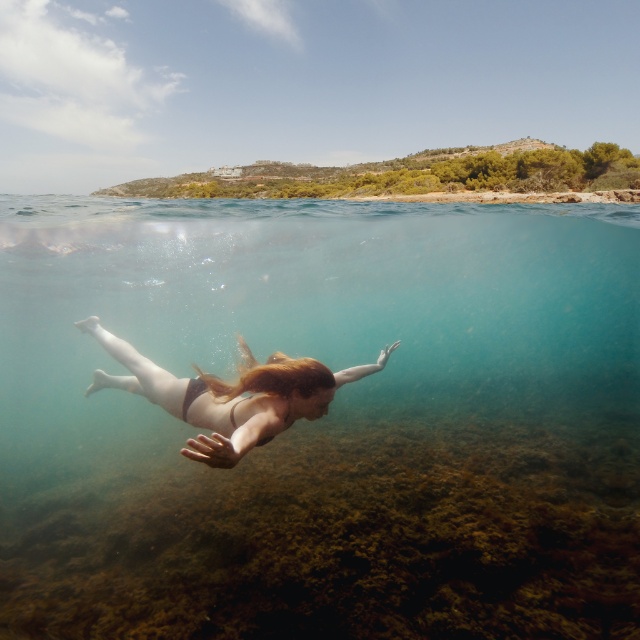
You are a photographer aiming to capture the swimmer in the image. You want to ensure the clear blue water at center and the blonde silky hair at center are both in focus. Which object should you adjust your camera focus to prioritize to ensure both are sharp?

The clear blue water at center is wider than the blonde silky hair at center, so you should focus on the wider area of the clear blue water at center to ensure both objects are in focus.

You are a photographer trying to capture the swimmer in the image. You notice the smooth skin girl at center and the blonde silky hair at center. Which object should you focus on if you want to ensure the larger subject is in sharp focus?

The smooth skin girl at center is bigger than the blonde silky hair at center, so you should focus on the smooth skin girl at center to ensure the larger subject is in sharp focus.